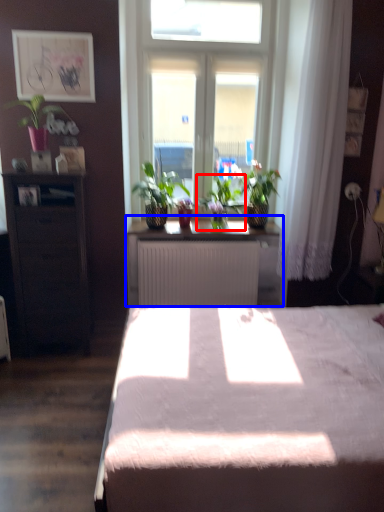
Question: Which object is closer to the camera taking this photo, houseplant (highlighted by a red box) or table (highlighted by a blue box)?

Choices:
 (A) houseplant
 (B) table

Answer: (B)